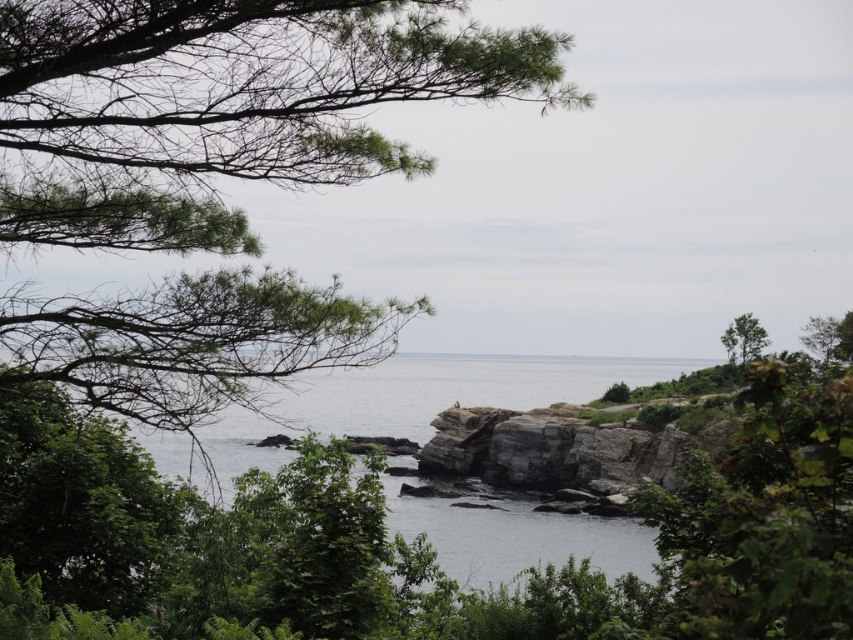
You are standing at the center of the image and want to reach the clear water at center. According to the coordinates provided, in which direction should you move to reach it?

The clear water at center is located at coordinates point (x=392, y=404), so you should move towards the center of the image to reach it.